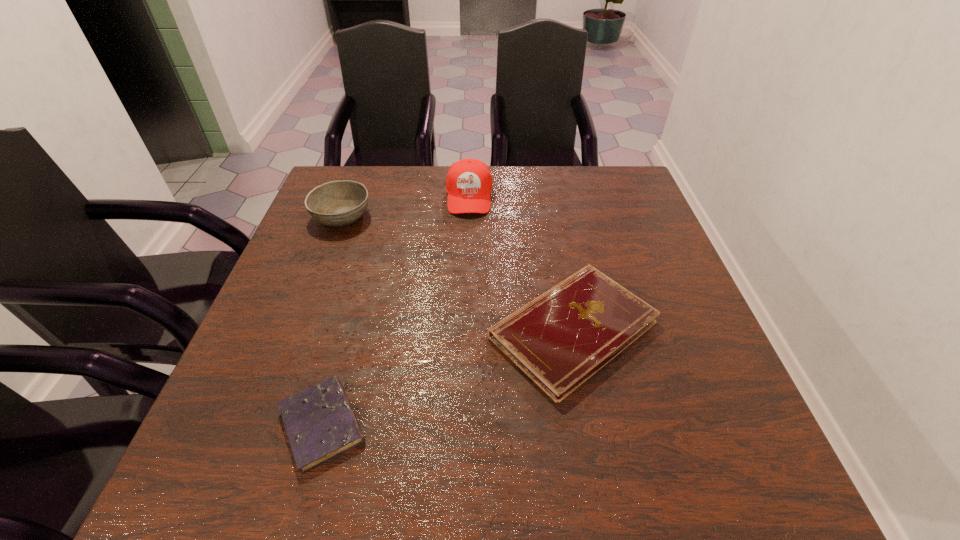
Locate an element on the screen. This screenshot has width=960, height=540. object that is at the near edge is located at coordinates (320, 423).

Identify the location of bowl that is at the left edge. This screenshot has height=540, width=960. (337, 203).

Where is `diary located at the left edge`? This screenshot has height=540, width=960. diary located at the left edge is located at coordinates (320, 423).

Locate an element on the screen. The height and width of the screenshot is (540, 960). object that is at the right edge is located at coordinates (560, 339).

I want to click on object at the far left corner, so click(x=337, y=203).

Locate an element on the screen. The height and width of the screenshot is (540, 960). object positioned at the near left corner is located at coordinates (320, 423).

Where is `vacant space at the far edge of the desktop`? The height and width of the screenshot is (540, 960). vacant space at the far edge of the desktop is located at coordinates (437, 193).

Identify the location of vacant space at the near edge of the desktop. The width and height of the screenshot is (960, 540). (639, 469).

This screenshot has height=540, width=960. Find the location of `vacant space at the left edge of the desktop`. vacant space at the left edge of the desktop is located at coordinates (301, 268).

At what (x,y) coordinates should I click in order to perform the action: click on vacant space at the right edge of the desktop. Please return your answer as a coordinate pair (x, y). This screenshot has width=960, height=540. Looking at the image, I should click on (714, 444).